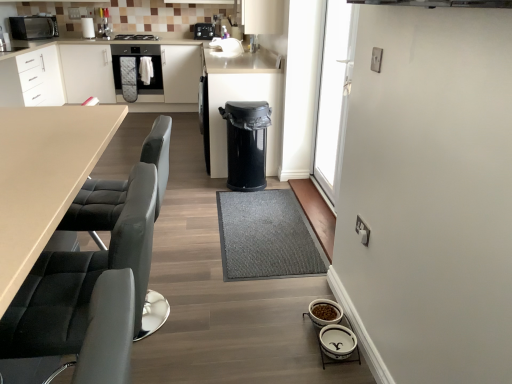
You are a GUI agent. You are given a task and a screenshot of the screen. Output one action in this format:
    pyautogui.click(x=<x>, y=<y>)
    Task: Click on the free space above gray textured mat at center (from a real-world perspective)
    
    Given the screenshot: What is the action you would take?
    pyautogui.click(x=269, y=227)